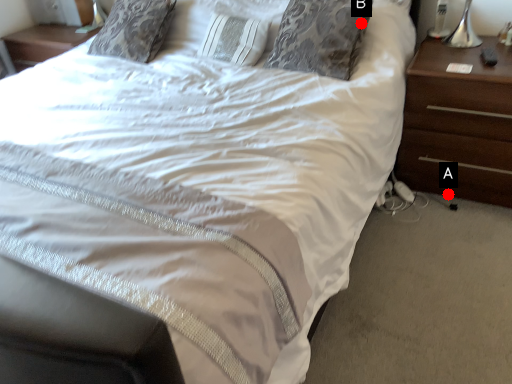
Question: Two points are circled on the image, labeled by A and B beside each circle. Which point is further to the camera?

Choices:
 (A) A is further
 (B) B is further

Answer: (A)